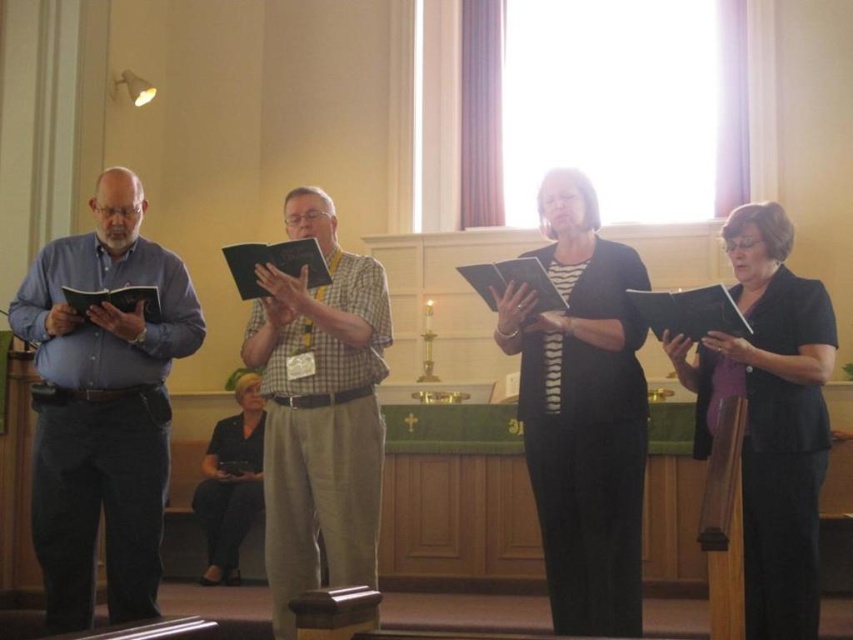
Is point (154, 468) in front of point (242, 400)?

Yes, it is in front of point (242, 400).

Which is behind, point (39, 452) or point (231, 570)?

The point (231, 570) is more distant.

Between point (146, 387) and point (216, 518), which one is positioned in front?

Point (146, 387) is in front.

You are a GUI agent. You are given a task and a screenshot of the screen. Output one action in this format:
    pyautogui.click(x=<x>, y=<y>)
    Task: Click on the blue shirt at left
    
    Given the screenshot: What is the action you would take?
    pyautogui.click(x=102, y=404)

Does blue shirt at left have a lesser height compared to checkered fabric shirt at center?

Incorrect, blue shirt at left's height does not fall short of checkered fabric shirt at center's.

Does blue shirt at left come behind checkered fabric shirt at center?

That is True.

Between point (125, 256) and point (332, 388), which one is positioned behind?

Point (125, 256)

Find the location of `blue shirt at left`. blue shirt at left is located at coordinates (102, 404).

From the picture: Which is below, black matte book at center or black fabric book at lower left?

black fabric book at lower left

Does black matte book at center appear under black fabric book at lower left?

Incorrect, black matte book at center is not positioned below black fabric book at lower left.

Who is more forward, (813, 548) or (260, 401)?

Point (813, 548) is in front.

You are a GUI agent. You are given a task and a screenshot of the screen. Output one action in this format:
    pyautogui.click(x=<x>, y=<y>)
    Task: Click on the black matte book at center
    The height and width of the screenshot is (640, 853).
    Given the screenshot: What is the action you would take?
    pyautogui.click(x=769, y=417)